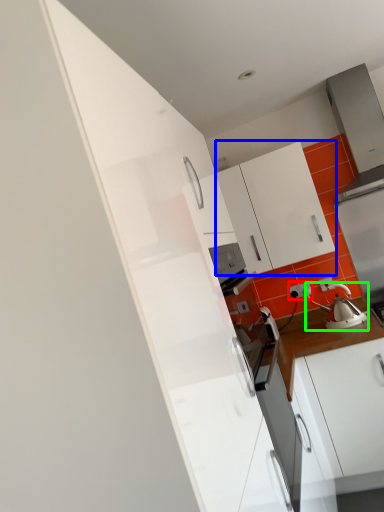
Question: Considering the real-world distances, which object is closest to electric outlet (highlighted by a red box)? cabinetry (highlighted by a blue box) or tea pot (highlighted by a green box).

Choices:
 (A) cabinetry
 (B) tea pot

Answer: (B)